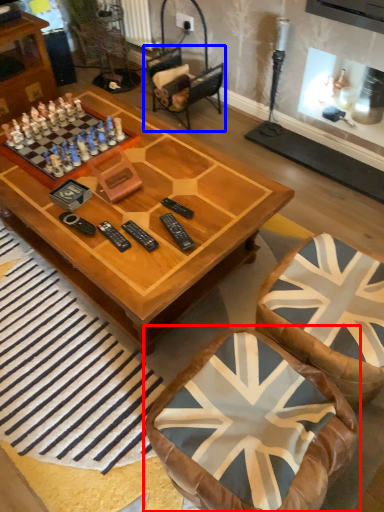
Question: Among these objects, which one is nearest to the camera, chair (highlighted by a red box) or armchair (highlighted by a blue box)?

Choices:
 (A) chair
 (B) armchair

Answer: (A)